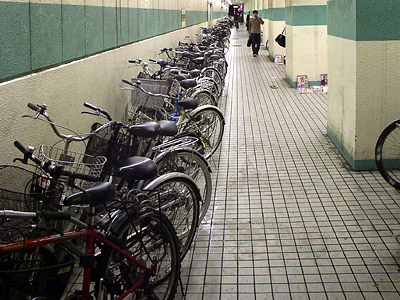
What are the coordinates of `floor` in the screenshot? It's located at (280, 131).